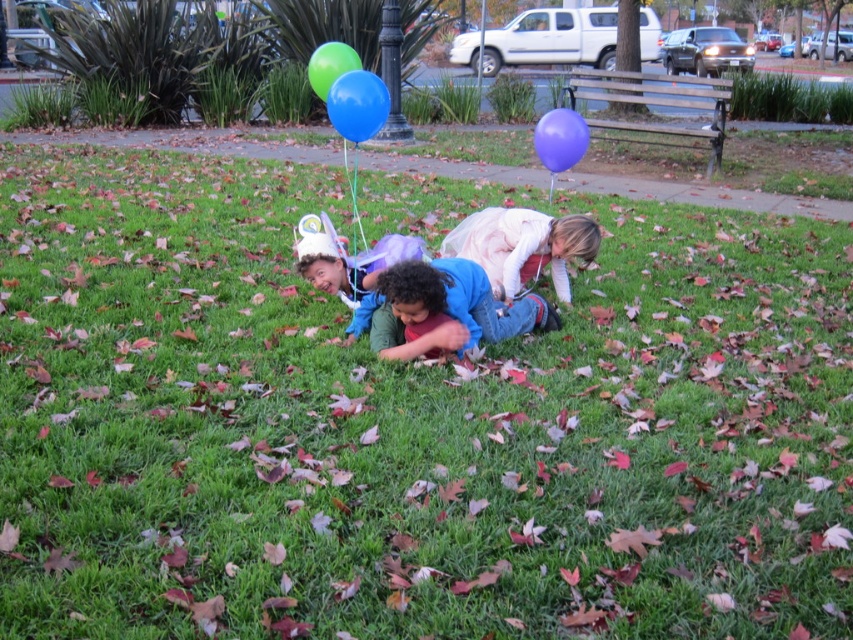
You are standing in the park and want to take a photo of both the point at (346, 140) and the point at (579, 156). Which point will appear closer to the camera in the photo?

Result: The point at (346, 140) will appear closer to the camera in the photo because it is further to the camera than the point at (579, 156).

You are a photographer standing at the edge of the park. You want to capture a photo of the blue denim jeans at center and the matte purple balloon at upper right in the same frame. Based on their positions, which object should you focus on first to ensure both are in the shot?

The blue denim jeans at center should be focused on first since it is to the left of the matte purple balloon at upper right, so adjusting the camera to include both from left to right would start with the leftmost object.